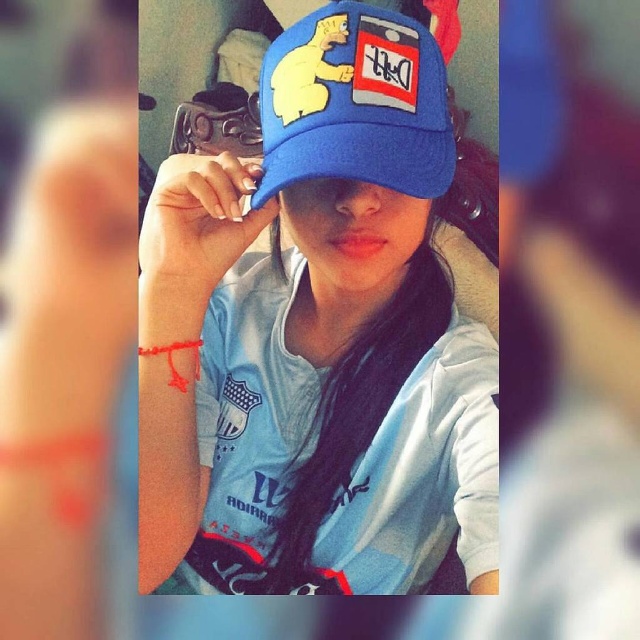
Between blue fabric cap at center and blue fabric baseball cap at center, which one appears on the right side from the viewer's perspective?

blue fabric baseball cap at center

Is blue fabric cap at center positioned behind blue fabric baseball cap at center?

No, blue fabric cap at center is in front of blue fabric baseball cap at center.

From the picture: Who is more forward, (371, 547) or (364, 99)?

Point (364, 99) is more forward.

The width and height of the screenshot is (640, 640). I want to click on blue fabric cap at center, so click(317, 337).